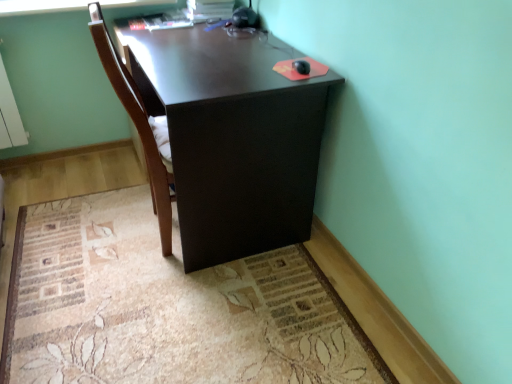
At what (x,y) coordinates should I click in order to perform the action: click on free space above dark wood desk at center (from a real-world perspective). Please return your answer as a coordinate pair (x, y). Image resolution: width=512 pixels, height=384 pixels. Looking at the image, I should click on (194, 37).